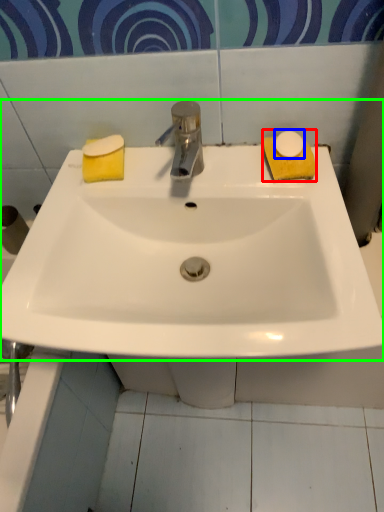
Question: Estimate the real-world distances between objects in this image. Which object is farther from soap (highlighted by a red box), soap (highlighted by a blue box) or sink (highlighted by a green box)?

Choices:
 (A) soap
 (B) sink

Answer: (B)